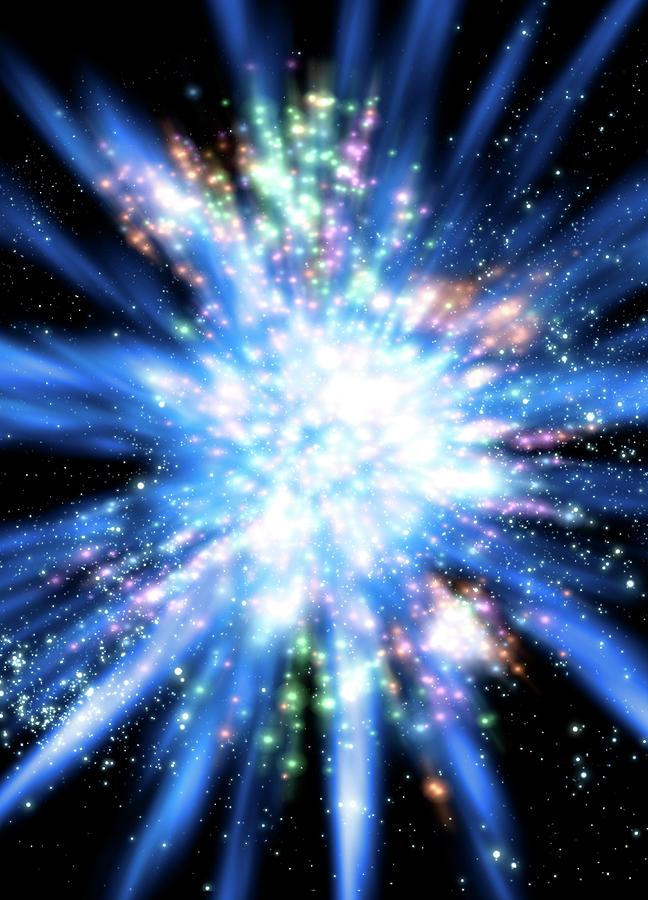
Locate an element on the screen. The height and width of the screenshot is (900, 648). bright white light is located at coordinates (352, 410).